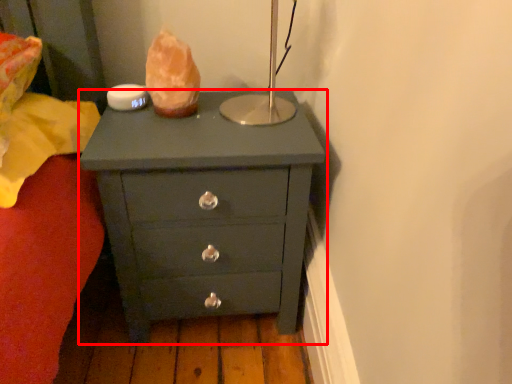
Question: From the image's perspective, what is the correct spatial positioning of chest of drawers (annotated by the red box) in reference to food?

Choices:
 (A) below
 (B) above

Answer: (A)